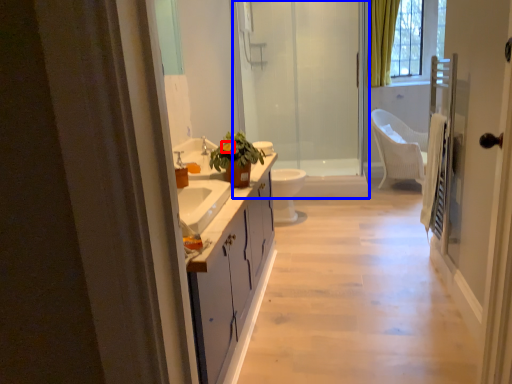
Question: Which object appears farthest to the camera in this image, flower (highlighted by a red box) or shower door (highlighted by a blue box)?

Choices:
 (A) flower
 (B) shower door

Answer: (B)